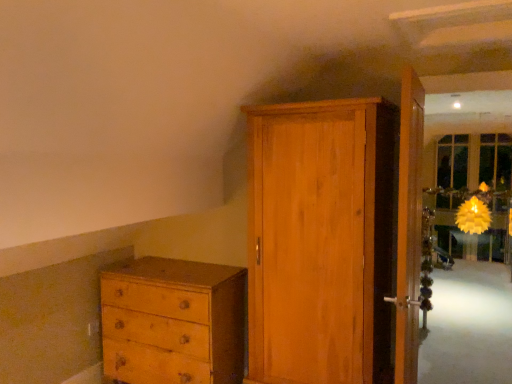
Locate an element on the screen. empty space that is ontop of light brown wood chest of drawers at lower left (from a real-world perspective) is located at coordinates (170, 274).